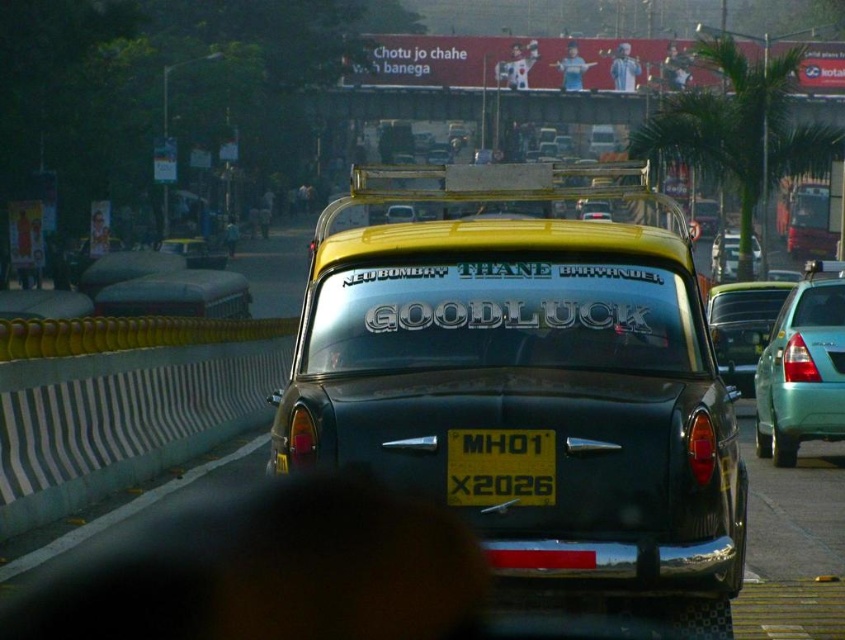
You are a pedestrian trying to cross the road in this busy scene. You see a green matte sedan at right and a metallic silver car at center. Which car is closer to you?

The green matte sedan at right is closer to you because it is in front of the metallic silver car at center.

You are a tourist in Mumbai and notice the vintage black car with a yellow roof. You want to take a photo of the green leafy palm tree at upper right and the yellow matte license plate at center in the same frame. Based on their positions, can you tell which object is higher in the image?

The green leafy palm tree at upper right is above the yellow matte license plate at center, so the palm tree is higher in the image.